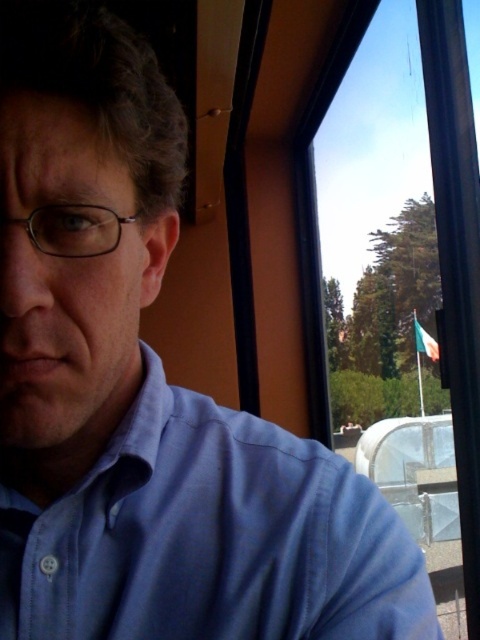
Question: Is blue cotton dress shirt at upper left above transparent glass window at upper right?

Choices:
 (A) yes
 (B) no

Answer: (B)

Question: Does blue cotton dress shirt at upper left lie behind transparent glass window at upper right?

Choices:
 (A) no
 (B) yes

Answer: (A)

Question: Does blue cotton dress shirt at upper left have a larger size compared to transparent glass window at upper right?

Choices:
 (A) no
 (B) yes

Answer: (A)

Question: Which of the following is the closest to the observer?

Choices:
 (A) transparent glass window at upper right
 (B) blue cotton dress shirt at upper left

Answer: (B)